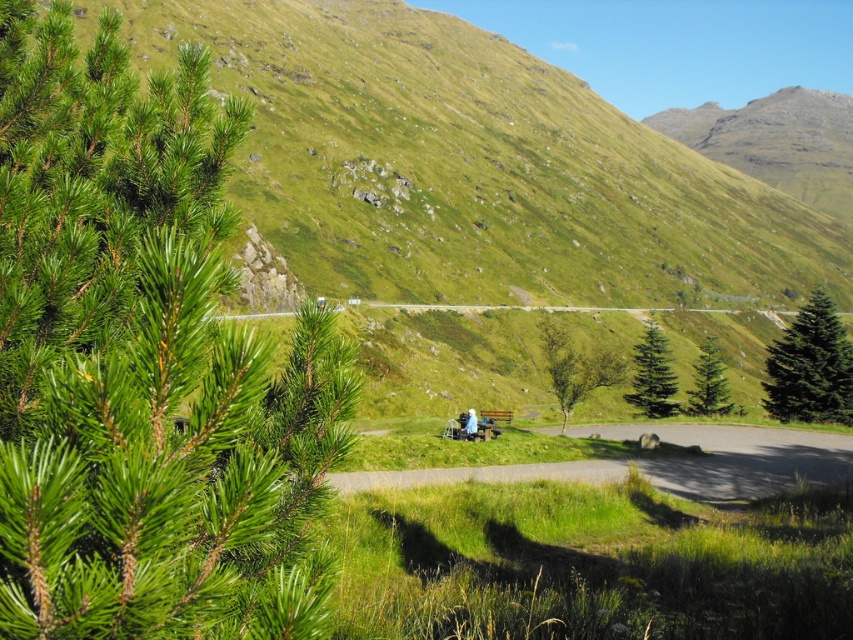
Can you confirm if green needle-like at left is wider than light blue fabric at center?

Indeed, green needle-like at left has a greater width compared to light blue fabric at center.

Between point (163, 400) and point (474, 435), which one is positioned in front?

Point (163, 400) is more forward.

The height and width of the screenshot is (640, 853). Find the location of `green needle-like at left`. green needle-like at left is located at coordinates (144, 364).

In the scene shown: Does gravel path at center have a greater width compared to green leafy tree at center?

Yes.

Does gravel path at center have a greater height compared to green leafy tree at center?

In fact, gravel path at center may be shorter than green leafy tree at center.

Which is in front, point (572, 468) or point (552, 362)?

Point (572, 468) is in front.

Where is `gravel path at center`? Image resolution: width=853 pixels, height=640 pixels. gravel path at center is located at coordinates (735, 458).

Can you confirm if green needle-like at left is taller than green leafy tree at center?

No.

Who is positioned more to the left, green needle-like at left or green leafy tree at center?

green needle-like at left

Is point (106, 326) positioned in front of point (564, 372)?

Yes, it is.

The image size is (853, 640). In order to click on green needle-like at left in this screenshot , I will do `click(144, 364)`.